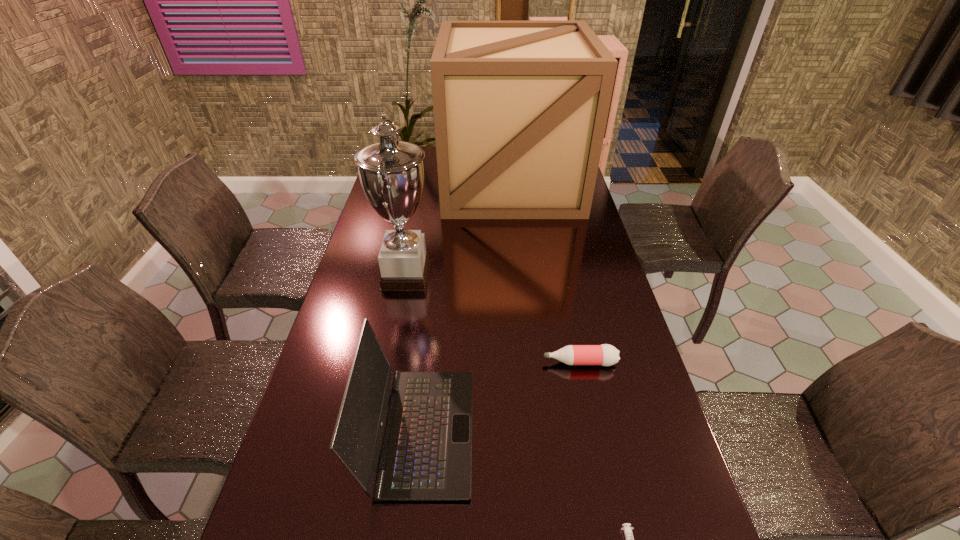
Identify the location of free space between the fourth nearest object and the box. (459, 229).

The width and height of the screenshot is (960, 540). In order to click on empty location between the laptop computer and the fourth nearest object in this screenshot , I will do `click(413, 354)`.

The height and width of the screenshot is (540, 960). I want to click on vacant region between the box and the fourth farthest object, so click(x=465, y=307).

I want to click on free space between the farthest object and the third nearest object, so click(545, 272).

Find the location of `free area in between the bottle and the box`. free area in between the bottle and the box is located at coordinates (545, 272).

Locate an element on the screen. the closest object to the nearest object is located at coordinates (426, 451).

Find the location of a particular element. The width and height of the screenshot is (960, 540). the third closest object relative to the laptop computer is located at coordinates (629, 537).

This screenshot has height=540, width=960. In order to click on vacant space that satisfies the following two spatial constraints: 1. on the reinforced sides of the box; 2. on the screen of the third tallest object in this screenshot , I will do `click(538, 432)`.

In order to click on vacant space that satisfies the following two spatial constraints: 1. on the reinforced sides of the farthest object; 2. on the screen of the fourth farthest object in this screenshot , I will do click(538, 432).

Locate an element on the screen. The image size is (960, 540). free spot that satisfies the following two spatial constraints: 1. on the reinforced sides of the box; 2. at the front view of the second farthest object is located at coordinates (521, 276).